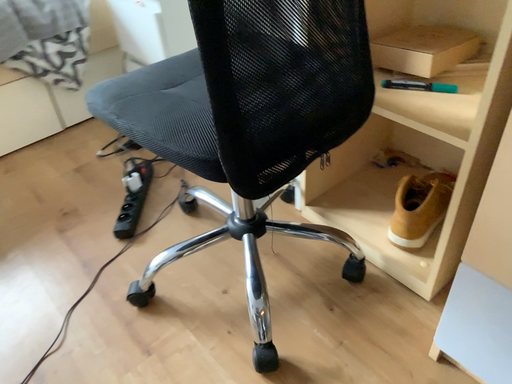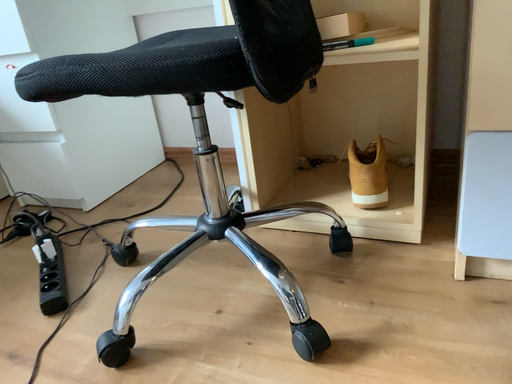
Question: Which way did the camera rotate in the video?

Choices:
 (A) rotated downward
 (B) rotated upward

Answer: (B)